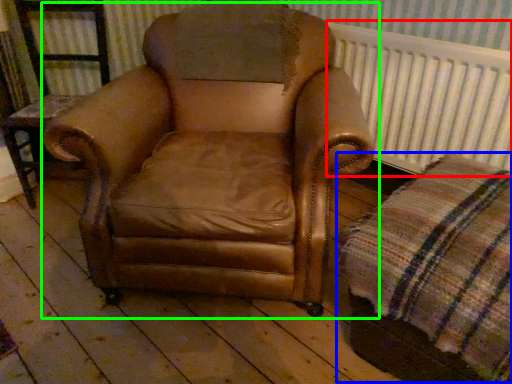
Question: Which is nearer to the radiator (highlighted by a red box)? plaid (highlighted by a blue box) or chair (highlighted by a green box).

Choices:
 (A) plaid
 (B) chair

Answer: (B)